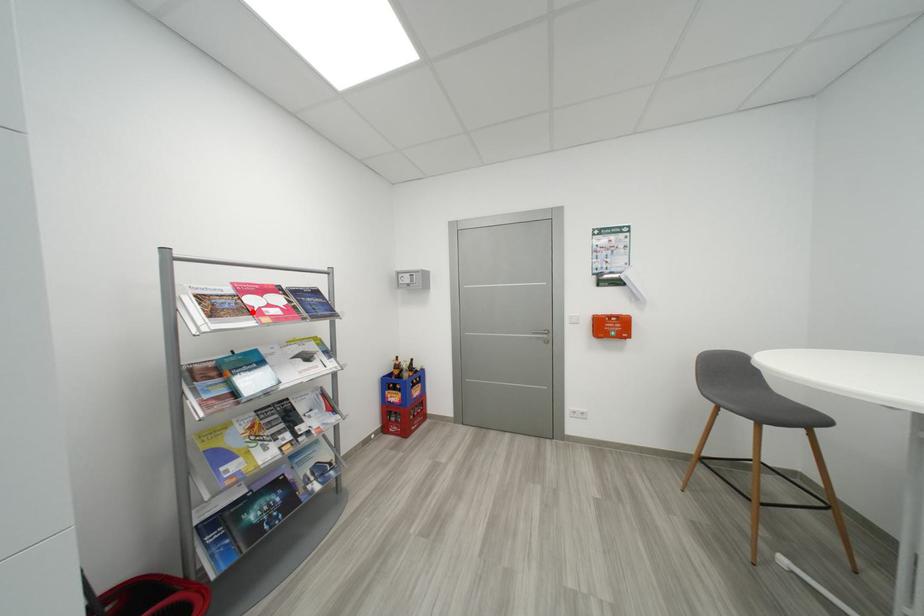
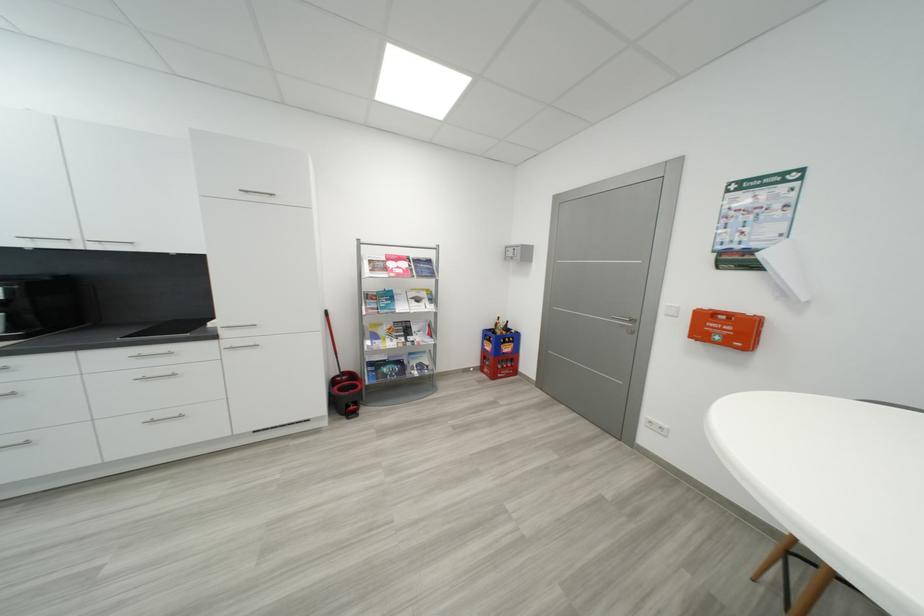
Where in the second image is the point corresponding to the highlighted location from the first image?

(393, 270)